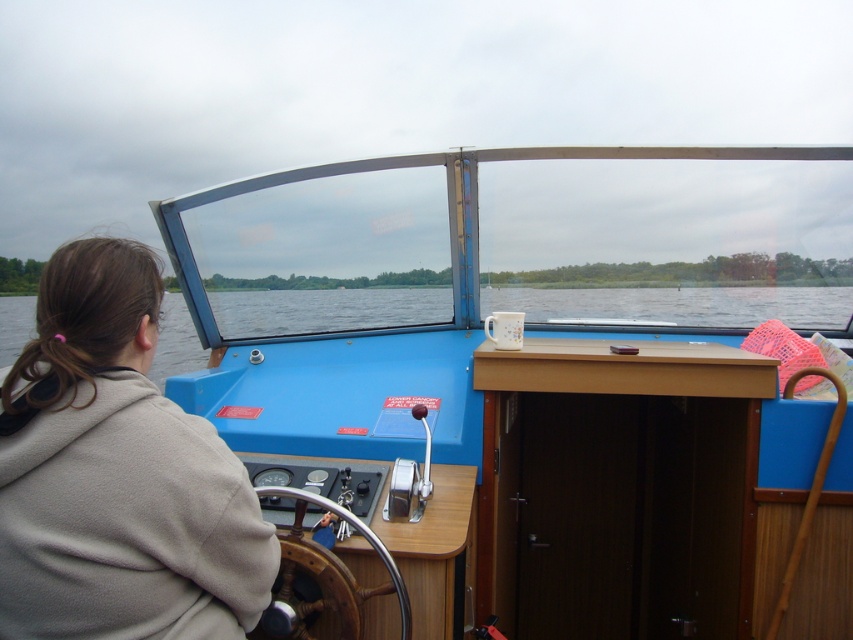
Between beige fleece jacket at lower left and transparent glass water at center, which one appears on the left side from the viewer's perspective?

transparent glass water at center is more to the left.

Between point (207, 572) and point (15, 316), which one is positioned in front?

Positioned in front is point (207, 572).

Between point (30, 378) and point (172, 342), which one is positioned behind?

The point (172, 342) is behind.

You are a GUI agent. You are given a task and a screenshot of the screen. Output one action in this format:
    pyautogui.click(x=<x>, y=<y>)
    Task: Click on the beige fleece jacket at lower left
    Image resolution: width=853 pixels, height=640 pixels.
    Given the screenshot: What is the action you would take?
    pyautogui.click(x=117, y=474)